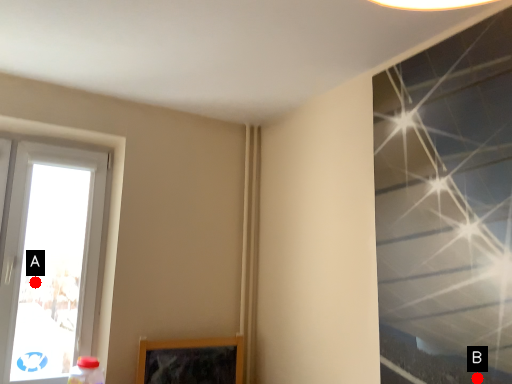
Question: Two points are circled on the image, labeled by A and B beside each circle. Which point is further to the camera?

Choices:
 (A) A is further
 (B) B is further

Answer: (A)